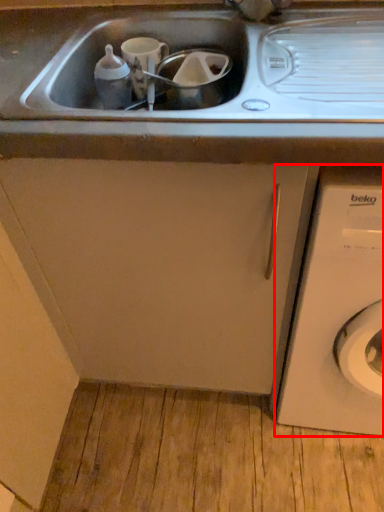
Question: Where is washing machine (annotated by the red box) located in relation to cabinetry in the image?

Choices:
 (A) left
 (B) right

Answer: (B)